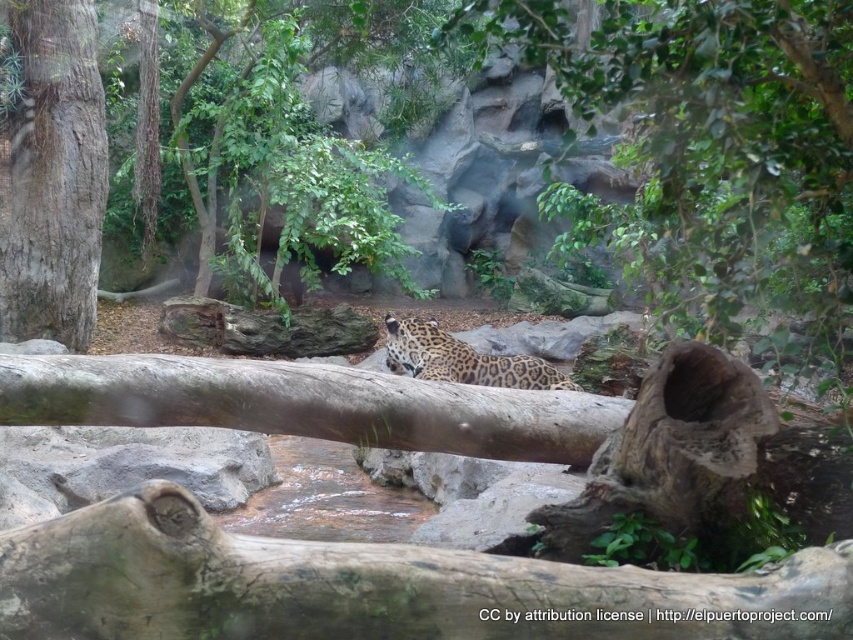
You are a zookeeper preparing to feed the jaguar. You notice the smooth brown log at center and the spotted fur leopard at center. Which object is closer to the front of the enclosure?

The smooth brown log at center is closer to the front of the enclosure because it is shorter than the spotted fur leopard at center, making it appear in front.

You are a zookeeper observing the jaguar enclosure. You notice two trees in the enclosure. Which tree is closer to the jaguar? The green leafy tree at center or the rough bark tree trunk at left?

The green leafy tree at center is closer to the viewer than the rough bark tree trunk at left, so the green leafy tree at center is closer to the jaguar.